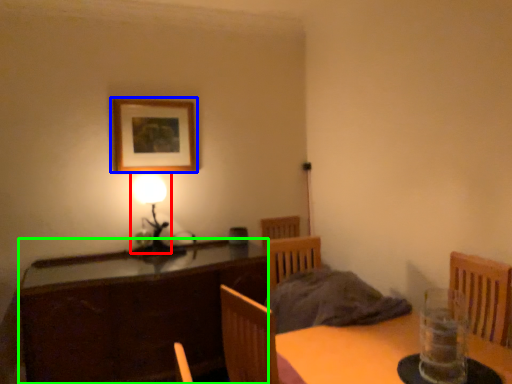
Question: Which object is positioned farthest from table lamp (highlighted by a red box)? Select from picture frame (highlighted by a blue box) and cabinetry (highlighted by a green box).

Choices:
 (A) picture frame
 (B) cabinetry

Answer: (B)